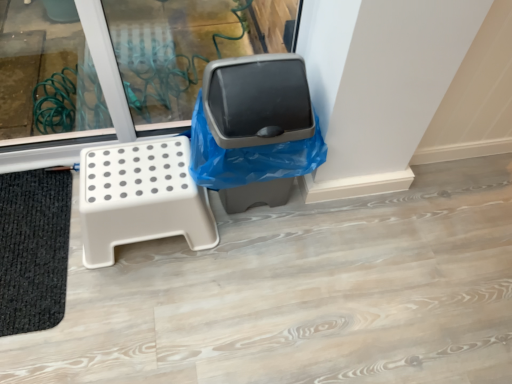
This screenshot has height=384, width=512. I want to click on unoccupied region to the right of white plastic stool at left, so click(x=249, y=264).